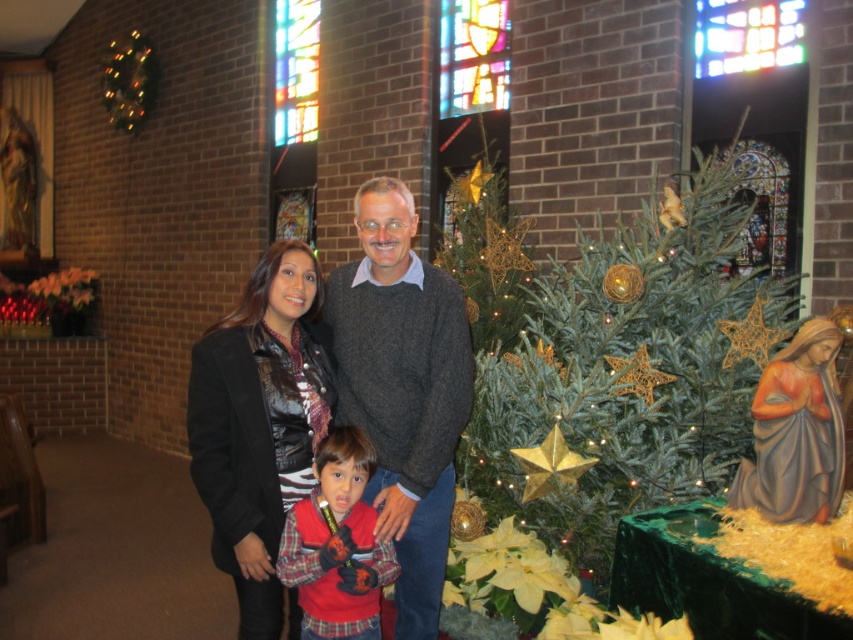
Can you confirm if dark gray sweater at center is wider than matte gray statue at right?

Yes.

Does dark gray sweater at center appear under matte gray statue at right?

Indeed, dark gray sweater at center is positioned under matte gray statue at right.

Who is more distant from viewer, [418,420] or [811,416]?

The point [418,420] is more distant.

Find the location of `dark gray sweater at center`. dark gray sweater at center is located at coordinates (402, 388).

Can you confirm if green textured christmas tree at right is wider than red fleece jacket at center?

Yes.

Locate an element on the screen. Image resolution: width=853 pixels, height=640 pixels. green textured christmas tree at right is located at coordinates (630, 371).

Where is `green textured christmas tree at right`? The width and height of the screenshot is (853, 640). green textured christmas tree at right is located at coordinates (630, 371).

Is green textured christmas tree at right positioned before black leather jacket at center?

No, green textured christmas tree at right is behind black leather jacket at center.

Between green textured christmas tree at right and black leather jacket at center, which one is positioned lower?

black leather jacket at center

Image resolution: width=853 pixels, height=640 pixels. Describe the element at coordinates (630, 371) in the screenshot. I see `green textured christmas tree at right` at that location.

Find the location of `green textured christmas tree at right`. green textured christmas tree at right is located at coordinates (630, 371).